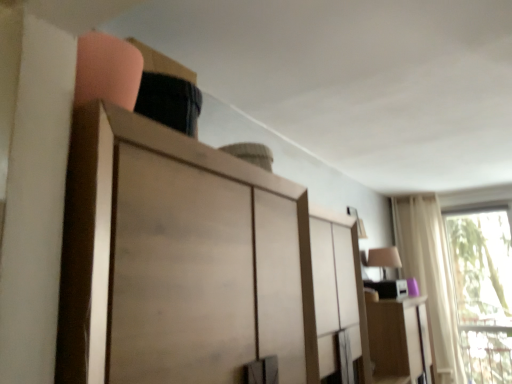
Locate an element on the screen. The image size is (512, 384). blank space situated above transparent glass window at right (from a real-world perspective) is located at coordinates (463, 199).